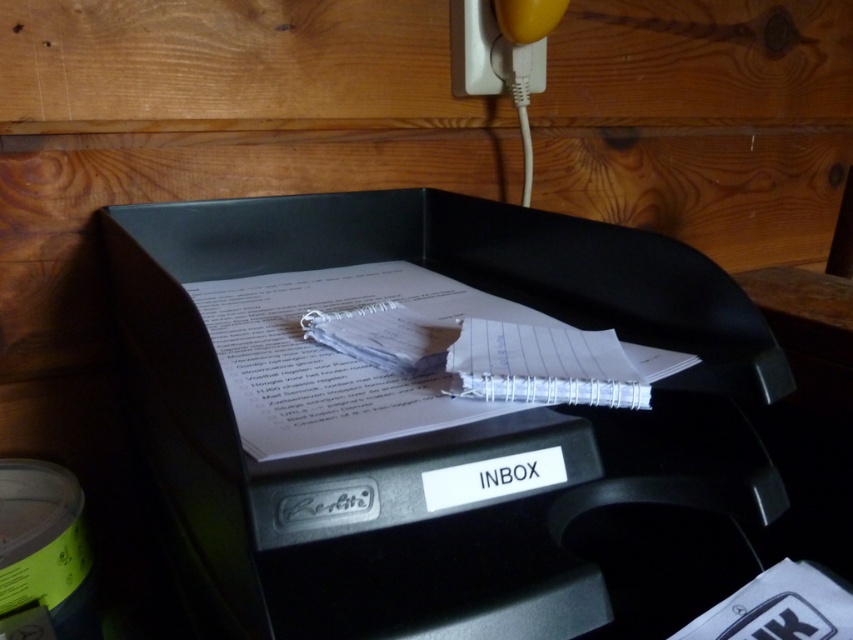
Question: Does white lined paper at center appear on the left side of yellow rubber at upper right?

Choices:
 (A) no
 (B) yes

Answer: (B)

Question: Which point is farther to the camera?

Choices:
 (A) yellow rubber at upper right
 (B) white lined paper at center
 (C) black plastic inbox at center

Answer: (A)

Question: Which of the following is the closest to the observer?

Choices:
 (A) white lined paper at center
 (B) black plastic inbox at center

Answer: (B)

Question: Is black plastic inbox at center to the right of yellow rubber at upper right from the viewer's perspective?

Choices:
 (A) yes
 (B) no

Answer: (B)

Question: Can you confirm if white lined paper at center is thinner than yellow rubber at upper right?

Choices:
 (A) no
 (B) yes

Answer: (A)

Question: Which of the following is the farthest from the observer?

Choices:
 (A) white lined paper at center
 (B) yellow rubber at upper right

Answer: (B)